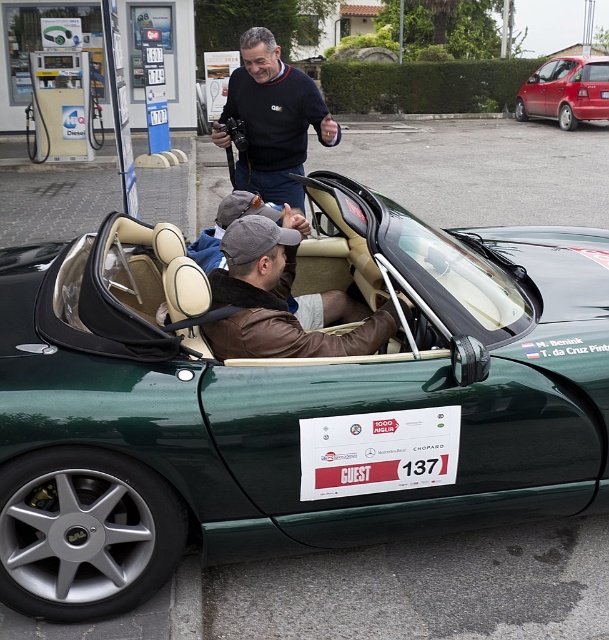
You are a photographer standing at the entrance of the gas station. You need to take a photo of the brown leather jacket at center and the metallic red hatchback at upper right. Which object should you focus on first if you want to capture both in a single shot without moving the camera?

You should focus on the brown leather jacket at center first because it is closer to you than the metallic red hatchback at upper right. Since the metallic red hatchback at upper right is further away, you can adjust the focus to include both by starting with the closer object.

You are standing at the entrance of the gas station and want to locate the green leather convertible at center. According to the coordinates provided, in which direction should you look to find it?

You should look towards the center of the image where the green leather convertible at center is located at coordinates point (289, 401).